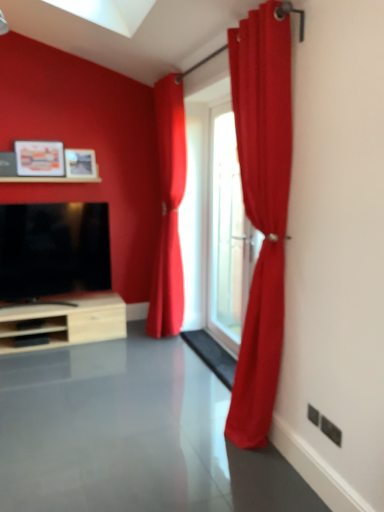
Question: From the image's perspective, is black glossy tv at left positioned above or below transparent glass door at center?

Choices:
 (A) above
 (B) below

Answer: (B)

Question: Considering the positions of black glossy tv at left and transparent glass door at center in the image, is black glossy tv at left bigger or smaller than transparent glass door at center?

Choices:
 (A) big
 (B) small

Answer: (A)

Question: Which object is positioned closest to the satin red curtain at center, placed as the first curtain when sorted from back to front?

Choices:
 (A) transparent glass door at center
 (B) matte wooden picture frame at upper left, which is counted as the first picture frame, starting from the left
 (C) black glossy tv at left
 (D) satin red curtain at right, which is counted as the 1th curtain, starting from the right
 (E) matte wooden picture frame at upper left, the second picture frame positioned from the left

Answer: (A)

Question: Which is farther from the satin red curtain at center, placed as the first curtain when sorted from back to front?

Choices:
 (A) satin red curtain at right, placed as the 1th curtain when sorted from front to back
 (B) matte wooden picture frame at upper left, the second picture frame when ordered from right to left
 (C) black glossy tv at left
 (D) transparent glass door at center
 (E) matte wooden picture frame at upper left, placed as the first picture frame when sorted from right to left

Answer: (A)